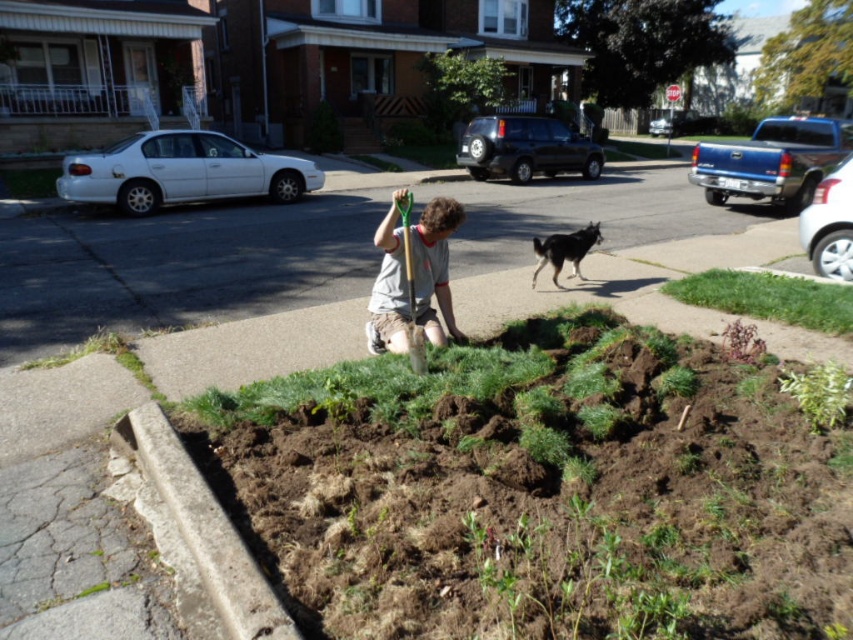
Question: Which object appears closest to the camera in this image?

Choices:
 (A) light gray t-shirt at center
 (B) black fur dog at center
 (C) green plastic shovel at center

Answer: (C)

Question: Does brown soil at center appear under green leafy plant at lower right?

Choices:
 (A) yes
 (B) no

Answer: (A)

Question: Can you confirm if green leafy plant at lower right is positioned to the right of black fur dog at center?

Choices:
 (A) yes
 (B) no

Answer: (A)

Question: Among these objects, which one is nearest to the camera?

Choices:
 (A) green grass at lower left
 (B) concrete at lower left
 (C) brown soil at center

Answer: (C)

Question: Which point appears farthest from the camera in this image?

Choices:
 (A) (410, 237)
 (B) (660, 204)
 (C) (99, 333)
 (D) (215, 518)

Answer: (B)

Question: From the image, what is the correct spatial relationship of green grass at lower right in relation to green grass at lower left?

Choices:
 (A) above
 (B) below

Answer: (A)